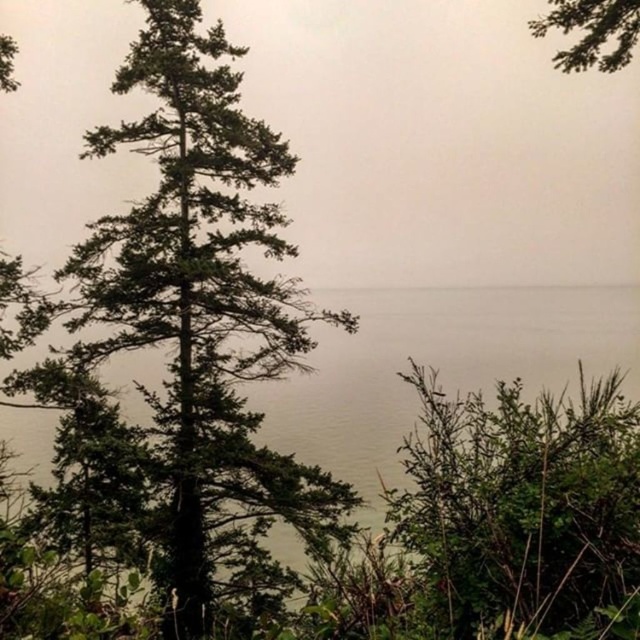
Question: Which object appears farthest from the camera in this image?

Choices:
 (A) green needle-like foliage at center-left
 (B) greenish water at center

Answer: (B)

Question: Which point is farther to the camera?

Choices:
 (A) green matte tree at upper right
 (B) greenish water at center
 (C) green leafy bush at lower right

Answer: (B)

Question: Does green needle-like foliage at center-left have a smaller size compared to green leafy bush at lower right?

Choices:
 (A) yes
 (B) no

Answer: (A)

Question: Does green needle-like foliage at center-left have a lesser width compared to greenish water at center?

Choices:
 (A) no
 (B) yes

Answer: (A)

Question: Is greenish water at center wider than green matte tree at upper right?

Choices:
 (A) no
 (B) yes

Answer: (A)

Question: Estimate the real-world distances between objects in this image. Which object is closer to the greenish water at center?

Choices:
 (A) green needle-like foliage at center-left
 (B) green leafy bush at lower right

Answer: (A)